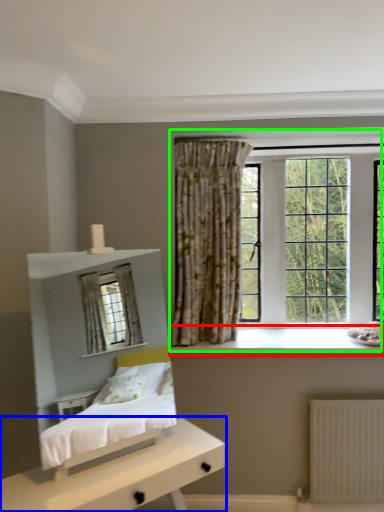
Question: Based on their relative distances, which object is nearer to window sill (highlighted by a red box)? Choose from nightstand (highlighted by a blue box) and window (highlighted by a green box).

Choices:
 (A) nightstand
 (B) window

Answer: (B)